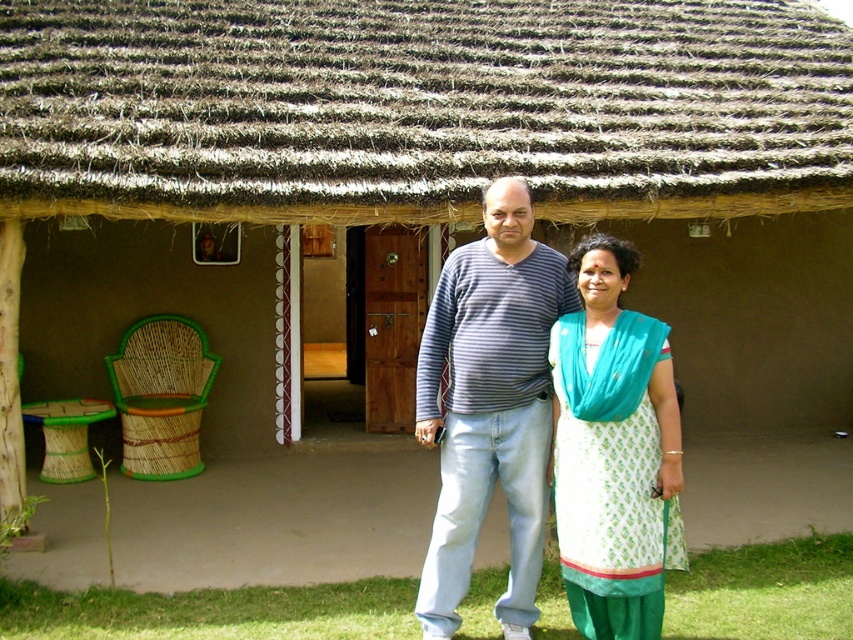
Looking at this image, you are an architect designing a new ecofriendly building. You observe the brown thatch at upper center and the striped cotton shirt at center in the scene. Which object has a greater width according to the description?

The brown thatch at upper center has a greater width than the striped cotton shirt at center as stated in the description.

You are a photographer trying to capture both the striped cotton shirt at center and the white printed cotton dress at center in a single frame. Which clothing item will appear larger in the photo?

The striped cotton shirt at center will appear larger in the photo because it is closer to the camera than the white printed cotton dress at center.